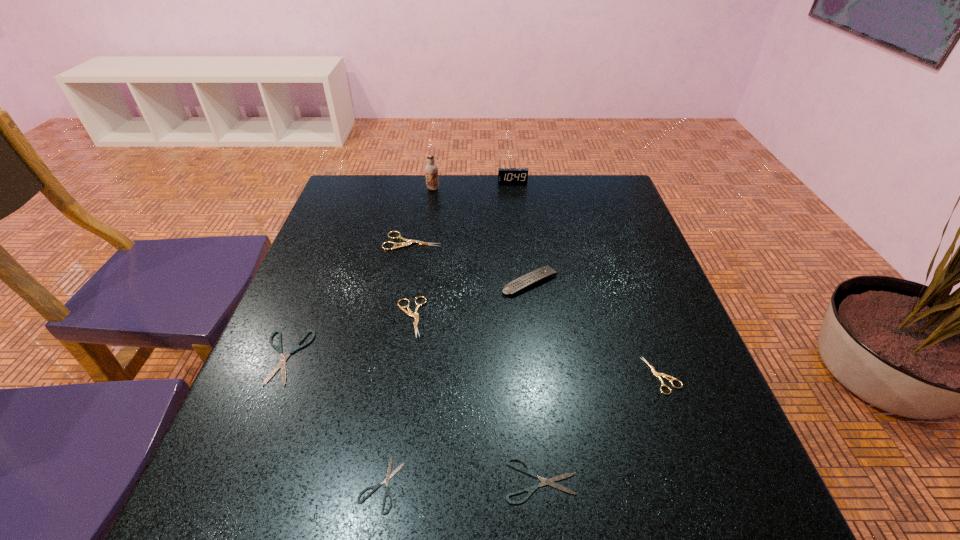
The width and height of the screenshot is (960, 540). Find the location of `the eighth nearest object`. the eighth nearest object is located at coordinates (431, 169).

Identify the location of the tallest object. (431, 169).

You are a GUI agent. You are given a task and a screenshot of the screen. Output one action in this format:
    pyautogui.click(x=<x>, y=<y>)
    Task: Click on the second tallest object
    The height and width of the screenshot is (540, 960).
    Given the screenshot: What is the action you would take?
    pyautogui.click(x=505, y=175)

Identify the location of the farthest object. (505, 175).

The height and width of the screenshot is (540, 960). Identify the location of the seventh shortest object. (545, 272).

Identify the location of the fourth farthest object. (545, 272).

Identify the location of the third farthest object. This screenshot has height=540, width=960. (408, 242).

Identify the location of the biggest beige shears. This screenshot has width=960, height=540. (408, 242).

Find the location of a particular element. the second farthest beige shears is located at coordinates (415, 315).

The height and width of the screenshot is (540, 960). Identify the location of the fifth tallest object. (415, 315).